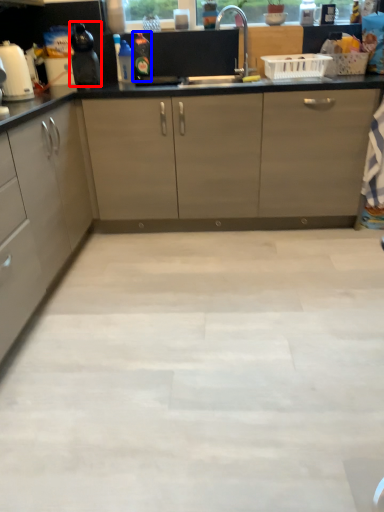
Question: Which object is further to the camera taking this photo, kitchen appliance (highlighted by a red box) or bottle (highlighted by a blue box)?

Choices:
 (A) kitchen appliance
 (B) bottle

Answer: (B)